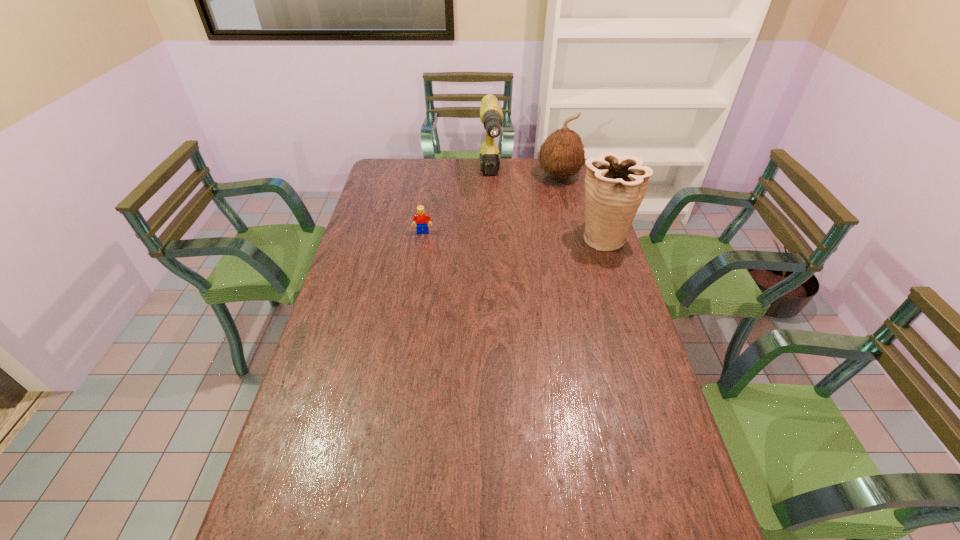
Image resolution: width=960 pixels, height=540 pixels. Find the location of `the leftmost object`. the leftmost object is located at coordinates tap(421, 218).

The width and height of the screenshot is (960, 540). Identify the location of Lego. (421, 218).

Where is `urn`? Image resolution: width=960 pixels, height=540 pixels. urn is located at coordinates (615, 185).

Locate an element on the screen. Image resolution: width=960 pixels, height=540 pixels. drill is located at coordinates (491, 116).

The height and width of the screenshot is (540, 960). Find the location of `coconut`. coconut is located at coordinates (562, 154).

The height and width of the screenshot is (540, 960). I want to click on free space located on the front-facing side of the shortest object, so click(x=415, y=289).

This screenshot has width=960, height=540. What are the coordinates of `blank space located on the back of the urn` in the screenshot? It's located at (586, 187).

The width and height of the screenshot is (960, 540). Identify the location of vacant region located 0.380m on the handle side of the drill. (498, 261).

Identify the location of vacant space located 0.230m on the handle side of the drill. (495, 234).

The image size is (960, 540). Identify the location of free point located 0.200m on the handle side of the drill. (495, 230).